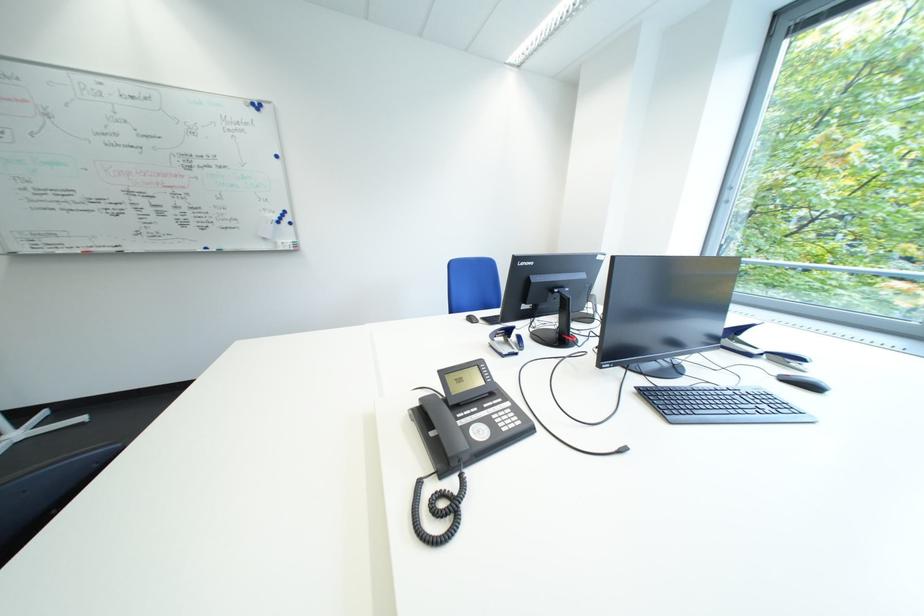
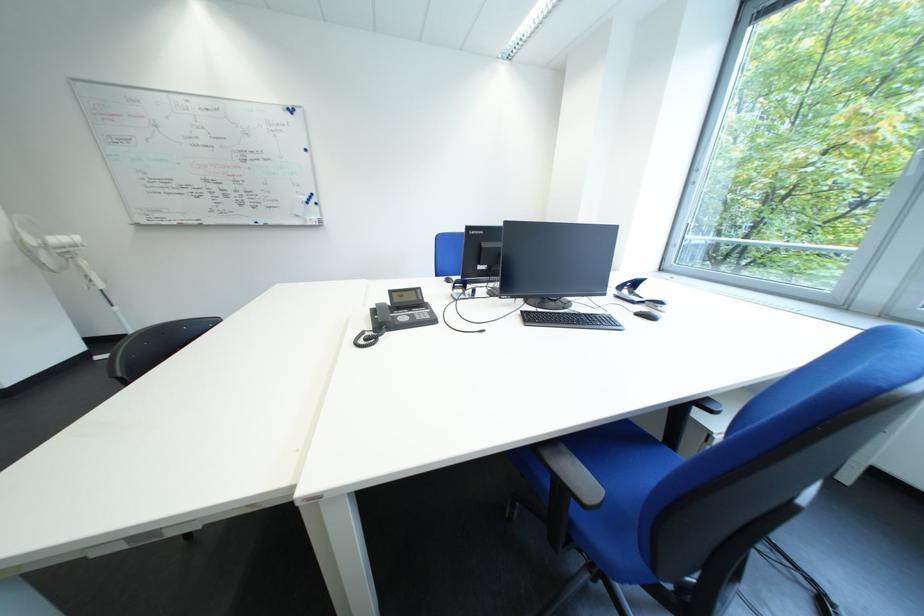
Which direction would the cameraman need to move to produce the second image?

The cameraman walked toward right, backward.